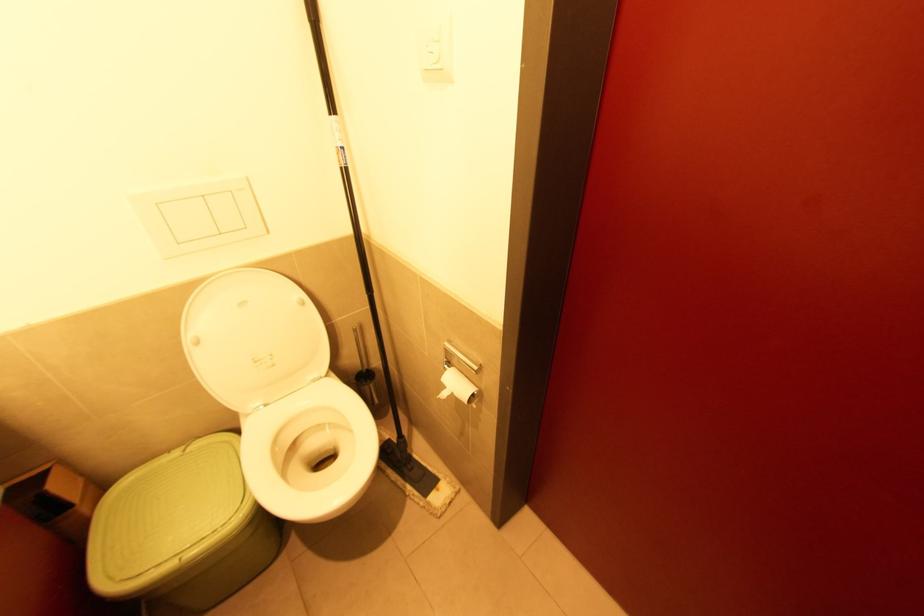
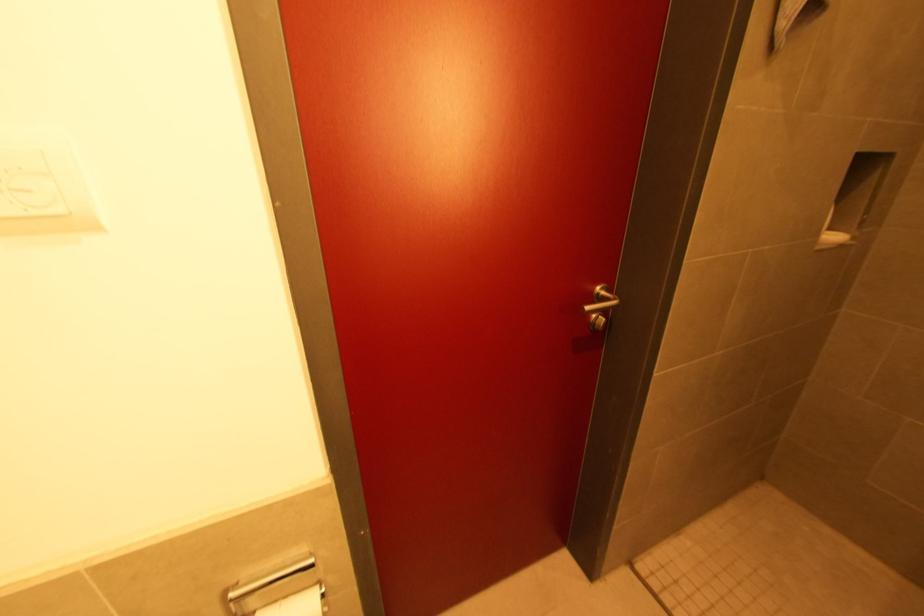
In the second image, find the point that corresponds to point (477, 394) in the first image.

(323, 591)